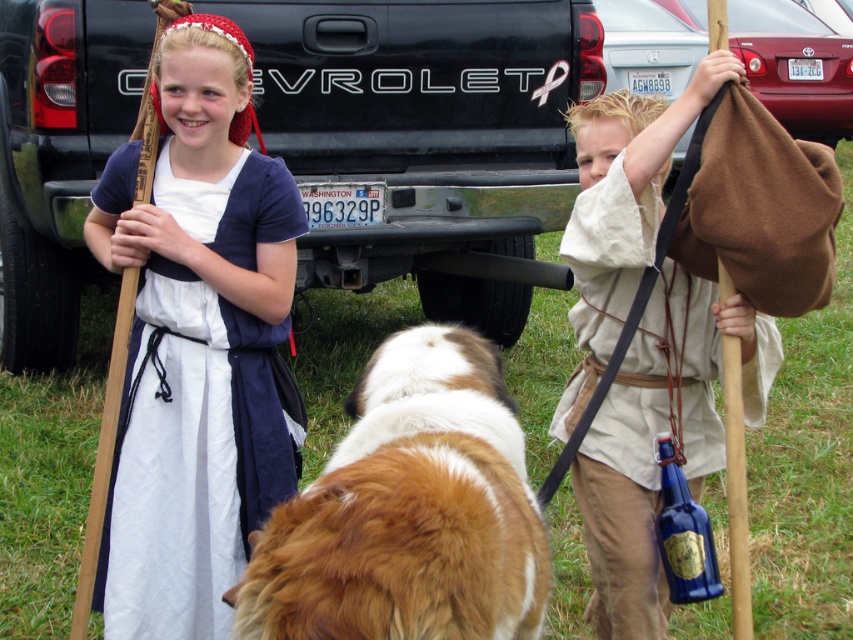
Between matte blue dress at center and brown fluffy dog at center, which one has less height?

Standing shorter between the two is brown fluffy dog at center.

Who is higher up, matte blue dress at center or brown fluffy dog at center?

matte blue dress at center is above.

Find the location of a particular element. The width and height of the screenshot is (853, 640). matte blue dress at center is located at coordinates (196, 342).

Is the position of brown fluffy dog at center more distant than that of matte brown cloth at upper right?

No.

Is point (509, 445) positioned after point (663, 164)?

No, it is not.

Describe the element at coordinates (408, 512) in the screenshot. I see `brown fluffy dog at center` at that location.

Image resolution: width=853 pixels, height=640 pixels. I want to click on brown fluffy dog at center, so click(408, 512).

Can you confirm if matte blue dress at center is wider than matte brown cloth at upper right?

Yes, matte blue dress at center is wider than matte brown cloth at upper right.

Does matte blue dress at center have a lesser height compared to matte brown cloth at upper right?

In fact, matte blue dress at center may be taller than matte brown cloth at upper right.

What do you see at coordinates (196, 342) in the screenshot? I see `matte blue dress at center` at bounding box center [196, 342].

Locate an element on the screen. The width and height of the screenshot is (853, 640). matte blue dress at center is located at coordinates (196, 342).